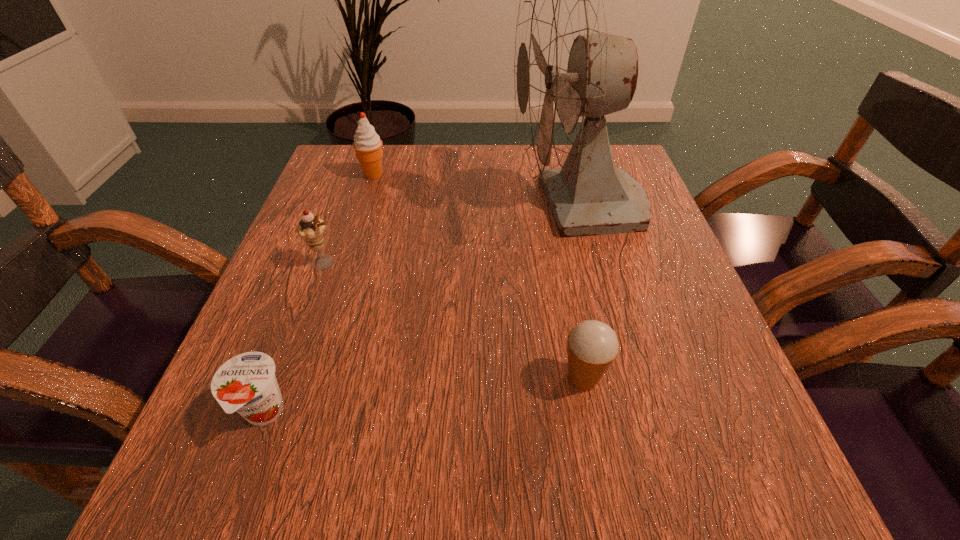
The width and height of the screenshot is (960, 540). What are the coordinates of `fan` in the screenshot? It's located at (569, 72).

Image resolution: width=960 pixels, height=540 pixels. In order to click on the farthest icecream in this screenshot , I will do `click(367, 144)`.

The image size is (960, 540). Identify the location of the second nearest icecream. (311, 229).

I want to click on the shortest icecream, so click(x=592, y=345).

Find the location of `the second shortest object`. the second shortest object is located at coordinates (592, 345).

At what (x,y) coordinates should I click in order to perform the action: click on yogurt. Please return your answer as a coordinate pair (x, y). Image resolution: width=960 pixels, height=540 pixels. Looking at the image, I should click on (246, 383).

Where is `vacant space located in front of the fan to blow air`? vacant space located in front of the fan to blow air is located at coordinates (442, 206).

Locate an element on the screen. free region located in front of the fan to blow air is located at coordinates (483, 206).

At what (x,y) coordinates should I click in order to perform the action: click on vacant space located 0.210m in front of the fan to blow air. Please return your answer as a coordinate pair (x, y). Looking at the image, I should click on (414, 206).

The height and width of the screenshot is (540, 960). I want to click on vacant area located 0.080m on the left of the farthest icecream, so click(326, 174).